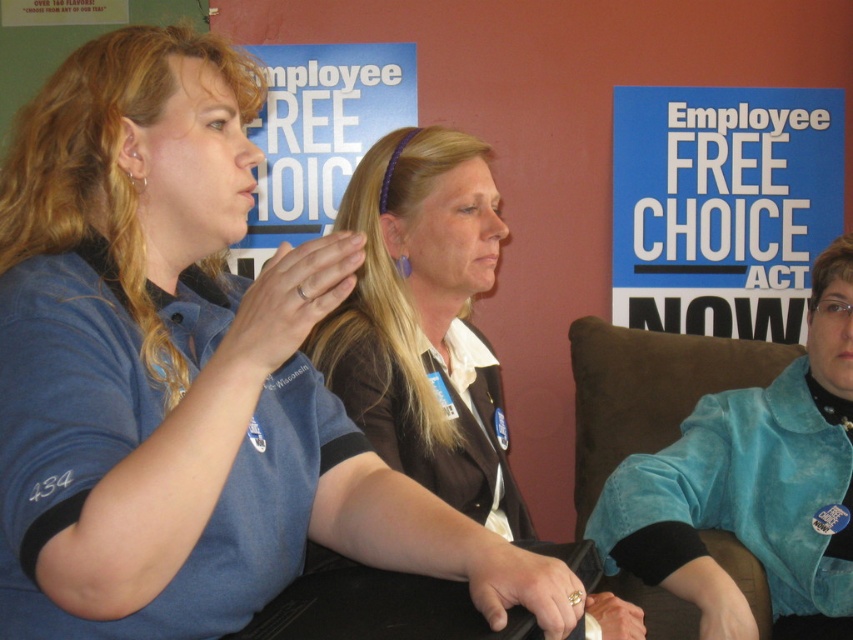
Question: In this image, where is blue fabric shirt at left located relative to brown suede chair at right?

Choices:
 (A) right
 (B) left

Answer: (B)

Question: Is matte brown jacket at center to the right of blue paper sign at upper center from the viewer's perspective?

Choices:
 (A) yes
 (B) no

Answer: (B)

Question: Which object is positioned farthest from the matte brown jacket at center?

Choices:
 (A) blue fabric poster at center
 (B) brown suede chair at right

Answer: (A)

Question: Which is farther from the blue fabric shirt at left?

Choices:
 (A) blue fabric poster at center
 (B) matte brown jacket at center
 (C) brown suede chair at right

Answer: (A)

Question: Based on their relative distances, which object is farther from the matte brown jacket at center?

Choices:
 (A) brown suede chair at right
 (B) blue paper sign at upper center
 (C) blue fabric poster at center

Answer: (B)

Question: Can you confirm if brown suede chair at right is positioned below blue fabric poster at center?

Choices:
 (A) yes
 (B) no

Answer: (A)